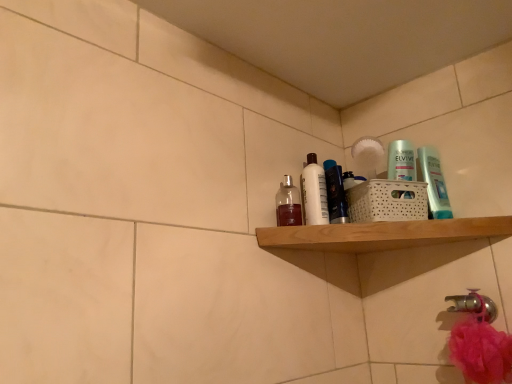
What are the coordinates of `translucent glass bottle at upper center, the 4th toiletry positioned from the right` in the screenshot? It's located at (288, 204).

Identify the location of shiny black bottle at center, which is the third toiletry in left-to-right order. The height and width of the screenshot is (384, 512). (335, 193).

Where is `gold metallic faucet at lower right`? This screenshot has width=512, height=384. gold metallic faucet at lower right is located at coordinates (474, 305).

Describe the element at coordinates (434, 183) in the screenshot. I see `translucent plastic bottle at upper right, the 1th toiletry when ordered from right to left` at that location.

This screenshot has width=512, height=384. What are the coordinates of `translucent glass bottle at upper center, placed as the first toiletry when sorted from left to right` in the screenshot? It's located at (288, 204).

Is point (296, 219) closer or farther from the camera than point (318, 203)?

Point (296, 219) is farther from the camera than point (318, 203).

Does translucent glass bottle at upper center, the 4th toiletry positioned from the right, come behind white glossy bottle at upper center, the second toiletry from the left?

No.

From a real-world perspective, count 3rd toiletrys upward from the translucent glass bottle at upper center, the 4th toiletry positioned from the right, and point to it. Please provide its 2D coordinates.

[(314, 192)]

How distant is translucent glass bottle at upper center, the 4th toiletry positioned from the right, from white glossy bottle at upper center, which is the 3th toiletry in right-to-left order?

The distance of translucent glass bottle at upper center, the 4th toiletry positioned from the right, from white glossy bottle at upper center, which is the 3th toiletry in right-to-left order, is 1.91 inches.

From the image's perspective, does gold metallic faucet at lower right appear higher than translucent plastic bottle at upper right, the 1th toiletry when ordered from right to left?

No, from the image's perspective, gold metallic faucet at lower right is not over translucent plastic bottle at upper right, the 1th toiletry when ordered from right to left.

Would you say gold metallic faucet at lower right is outside translucent plastic bottle at upper right, which is counted as the 4th toiletry, starting from the left?

Yes, gold metallic faucet at lower right is located beyond the bounds of translucent plastic bottle at upper right, which is counted as the 4th toiletry, starting from the left.

Can you confirm if gold metallic faucet at lower right is positioned to the left of translucent plastic bottle at upper right, the 1th toiletry when ordered from right to left?

In fact, gold metallic faucet at lower right is to the right of translucent plastic bottle at upper right, the 1th toiletry when ordered from right to left.

Between gold metallic faucet at lower right and translucent plastic bottle at upper right, which is counted as the 4th toiletry, starting from the left, which one has smaller width?

With smaller width is translucent plastic bottle at upper right, which is counted as the 4th toiletry, starting from the left.

Can you tell me how much wooden shelf at upper right and white glossy bottle at upper center, which is the 3th toiletry in right-to-left order, differ in facing direction?

The angular difference between wooden shelf at upper right and white glossy bottle at upper center, which is the 3th toiletry in right-to-left order, is 64.3 degrees.

From a real-world perspective, is wooden shelf at upper right located higher than white glossy bottle at upper center, the second toiletry from the left?

No, from a real-world perspective, wooden shelf at upper right is not over white glossy bottle at upper center, the second toiletry from the left

Based on the photo, is wooden shelf at upper right aimed at white glossy bottle at upper center, which is the 3th toiletry in right-to-left order?

No, wooden shelf at upper right does not turn towards white glossy bottle at upper center, which is the 3th toiletry in right-to-left order.

The image size is (512, 384). I want to click on shelf that is in front of the white glossy bottle at upper center, the second toiletry from the left, so click(382, 234).

At what (x,y) coordinates should I click in order to perform the action: click on toiletry lying above the shiny black bottle at center, which is the third toiletry in left-to-right order (from the image's perspective). Please return your answer as a coordinate pair (x, y). The height and width of the screenshot is (384, 512). Looking at the image, I should click on (x=434, y=183).

Which of these two, translucent plastic bottle at upper right, which is counted as the 4th toiletry, starting from the left, or shiny black bottle at center, which is the 2th toiletry in right-to-left order, stands taller?

With more height is shiny black bottle at center, which is the 2th toiletry in right-to-left order.

From a real-world perspective, which is physically below, translucent plastic bottle at upper right, the 1th toiletry when ordered from right to left, or shiny black bottle at center, which is the 2th toiletry in right-to-left order?

translucent plastic bottle at upper right, the 1th toiletry when ordered from right to left, is physically lower.

Is translucent plastic bottle at upper right, which is counted as the 4th toiletry, starting from the left, smaller than shiny black bottle at center, which is the third toiletry in left-to-right order?

Yes, translucent plastic bottle at upper right, which is counted as the 4th toiletry, starting from the left, is smaller than shiny black bottle at center, which is the third toiletry in left-to-right order.

Is gold metallic faucet at lower right to the right of white glossy bottle at upper center, which is the 3th toiletry in right-to-left order, from the viewer's perspective?

Correct, you'll find gold metallic faucet at lower right to the right of white glossy bottle at upper center, which is the 3th toiletry in right-to-left order.

Considering the positions of point (483, 308) and point (315, 201), is point (483, 308) closer or farther from the camera than point (315, 201)?

Clearly, point (483, 308) is closer to the camera than point (315, 201).

From a real-world perspective, is gold metallic faucet at lower right physically above white glossy bottle at upper center, the second toiletry from the left?

No, from a real-world perspective, gold metallic faucet at lower right is not above white glossy bottle at upper center, the second toiletry from the left.

Is gold metallic faucet at lower right turned away from white glossy bottle at upper center, which is the 3th toiletry in right-to-left order?

gold metallic faucet at lower right is not turned away from white glossy bottle at upper center, which is the 3th toiletry in right-to-left order.

Is translucent plastic bottle at upper right, the 1th toiletry when ordered from right to left, further to camera compared to wooden shelf at upper right?

That is True.

Find the location of a particular element. Image resolution: width=512 pixels, height=384 pixels. shelf in front of the translucent plastic bottle at upper right, the 1th toiletry when ordered from right to left is located at coordinates (382, 234).

Considering the relative sizes of translucent plastic bottle at upper right, which is counted as the 4th toiletry, starting from the left, and wooden shelf at upper right in the image provided, is translucent plastic bottle at upper right, which is counted as the 4th toiletry, starting from the left, bigger than wooden shelf at upper right?

No.

From a real-world perspective, is translucent plastic bottle at upper right, the 1th toiletry when ordered from right to left, positioned over wooden shelf at upper right based on gravity?

Indeed, from a real-world perspective, translucent plastic bottle at upper right, the 1th toiletry when ordered from right to left, stands above wooden shelf at upper right.

From a real-world perspective, is shiny black bottle at center, which is the third toiletry in left-to-right order, located beneath white glossy bottle at upper center, the second toiletry from the left?

Yes, from a real-world perspective, shiny black bottle at center, which is the third toiletry in left-to-right order, is under white glossy bottle at upper center, the second toiletry from the left.

Between shiny black bottle at center, which is the third toiletry in left-to-right order, and white glossy bottle at upper center, the second toiletry from the left, which one appears on the left side from the viewer's perspective?

white glossy bottle at upper center, the second toiletry from the left.

In terms of size, does shiny black bottle at center, which is the third toiletry in left-to-right order, appear bigger or smaller than white glossy bottle at upper center, which is the 3th toiletry in right-to-left order?

Considering their sizes, shiny black bottle at center, which is the third toiletry in left-to-right order, takes up more space than white glossy bottle at upper center, which is the 3th toiletry in right-to-left order.

How many degrees apart are the facing directions of shiny black bottle at center, which is the 2th toiletry in right-to-left order, and white glossy bottle at upper center, the second toiletry from the left?

9.16 degrees separate the facing orientations of shiny black bottle at center, which is the 2th toiletry in right-to-left order, and white glossy bottle at upper center, the second toiletry from the left.

Where is `toiletry on the left of the white glossy bottle at upper center, which is the 3th toiletry in right-to-left order`? Image resolution: width=512 pixels, height=384 pixels. toiletry on the left of the white glossy bottle at upper center, which is the 3th toiletry in right-to-left order is located at coordinates (288, 204).

The width and height of the screenshot is (512, 384). I want to click on tap in front of the translucent plastic bottle at upper right, which is counted as the 4th toiletry, starting from the left, so click(x=474, y=305).

When comparing their distances from white glossy bottle at upper center, which is the 3th toiletry in right-to-left order, does gold metallic faucet at lower right or translucent plastic bottle at upper right, the 1th toiletry when ordered from right to left, seem further?

Based on the image, gold metallic faucet at lower right appears to be further to white glossy bottle at upper center, which is the 3th toiletry in right-to-left order.

From the image, which object appears to be farther from translucent glass bottle at upper center, the 4th toiletry positioned from the right, translucent plastic bottle at upper right, which is counted as the 4th toiletry, starting from the left, or wooden shelf at upper right?

translucent plastic bottle at upper right, which is counted as the 4th toiletry, starting from the left.

When comparing their distances from translucent glass bottle at upper center, placed as the first toiletry when sorted from left to right, does shiny black bottle at center, which is the third toiletry in left-to-right order, or translucent plastic bottle at upper right, the 1th toiletry when ordered from right to left, seem further?

translucent plastic bottle at upper right, the 1th toiletry when ordered from right to left, is further to translucent glass bottle at upper center, placed as the first toiletry when sorted from left to right.

Estimate the real-world distances between objects in this image. Which object is further from wooden shelf at upper right, gold metallic faucet at lower right or translucent glass bottle at upper center, the 4th toiletry positioned from the right?

Among the two, gold metallic faucet at lower right is located further to wooden shelf at upper right.

In the scene shown: Based on their spatial positions, is shiny black bottle at center, which is the third toiletry in left-to-right order, or gold metallic faucet at lower right closer to translucent glass bottle at upper center, placed as the first toiletry when sorted from left to right?

shiny black bottle at center, which is the third toiletry in left-to-right order, is positioned closer to the anchor translucent glass bottle at upper center, placed as the first toiletry when sorted from left to right.

From the image, which object appears to be nearer to shiny black bottle at center, which is the 2th toiletry in right-to-left order, translucent plastic bottle at upper right, which is counted as the 4th toiletry, starting from the left, or white glossy bottle at upper center, which is the 3th toiletry in right-to-left order?

white glossy bottle at upper center, which is the 3th toiletry in right-to-left order.

From the image, which object appears to be farther from shiny black bottle at center, which is the third toiletry in left-to-right order, translucent plastic bottle at upper right, which is counted as the 4th toiletry, starting from the left, or wooden shelf at upper right?

translucent plastic bottle at upper right, which is counted as the 4th toiletry, starting from the left, is positioned further to the anchor shiny black bottle at center, which is the third toiletry in left-to-right order.

Which object lies further to the anchor point translucent glass bottle at upper center, placed as the first toiletry when sorted from left to right, gold metallic faucet at lower right or white glossy bottle at upper center, the second toiletry from the left?

gold metallic faucet at lower right is positioned further to the anchor translucent glass bottle at upper center, placed as the first toiletry when sorted from left to right.

At what (x,y) coordinates should I click in order to perform the action: click on shelf located between translucent glass bottle at upper center, the 4th toiletry positioned from the right, and gold metallic faucet at lower right in the left-right direction. Please return your answer as a coordinate pair (x, y). The height and width of the screenshot is (384, 512). Looking at the image, I should click on [x=382, y=234].

Where is `toiletry positioned between wooden shelf at upper right and translucent glass bottle at upper center, placed as the first toiletry when sorted from left to right, from near to far`? toiletry positioned between wooden shelf at upper right and translucent glass bottle at upper center, placed as the first toiletry when sorted from left to right, from near to far is located at coordinates (434, 183).

The width and height of the screenshot is (512, 384). What are the coordinates of `toiletry between white glossy bottle at upper center, which is the 3th toiletry in right-to-left order, and translucent plastic bottle at upper right, the 1th toiletry when ordered from right to left` in the screenshot? It's located at (335, 193).

The image size is (512, 384). I want to click on tap between wooden shelf at upper right and white glossy bottle at upper center, which is the 3th toiletry in right-to-left order, from front to back, so click(474, 305).